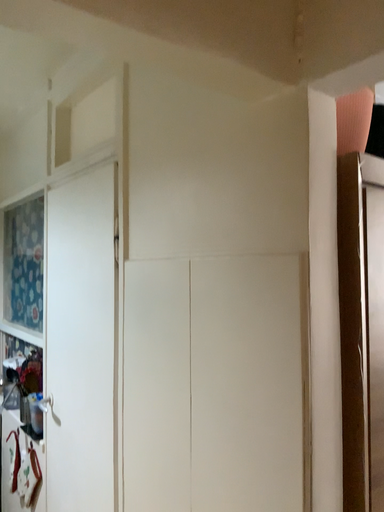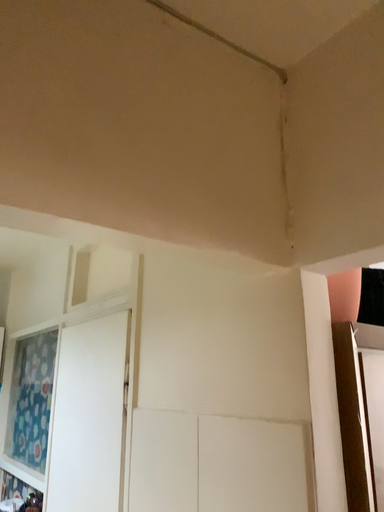
Question: Which way did the camera rotate in the video?

Choices:
 (A) rotated upward
 (B) rotated downward

Answer: (A)